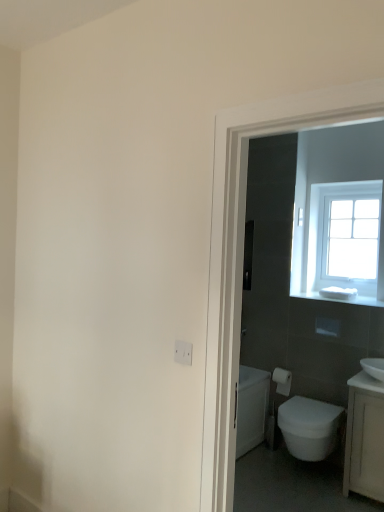
Question: Is white matte toilet paper at right oriented towards white plastic electric outlet at lower center?

Choices:
 (A) no
 (B) yes

Answer: (B)

Question: From a real-world perspective, is white matte toilet paper at right over white plastic electric outlet at lower center?

Choices:
 (A) no
 (B) yes

Answer: (A)

Question: Is white matte toilet paper at right wider than white plastic electric outlet at lower center?

Choices:
 (A) yes
 (B) no

Answer: (A)

Question: Does white matte toilet paper at right come behind white plastic electric outlet at lower center?

Choices:
 (A) no
 (B) yes

Answer: (B)

Question: Is white matte toilet paper at right far from white plastic electric outlet at lower center?

Choices:
 (A) yes
 (B) no

Answer: (A)

Question: Considering the positions of white matte toilet paper at right and white glossy bidet at lower right in the image, is white matte toilet paper at right bigger or smaller than white glossy bidet at lower right?

Choices:
 (A) small
 (B) big

Answer: (A)

Question: Considering their positions, is white matte toilet paper at right located in front of or behind white glossy bidet at lower right?

Choices:
 (A) front
 (B) behind

Answer: (B)

Question: Visually, is white matte toilet paper at right positioned to the left or to the right of white glossy bidet at lower right?

Choices:
 (A) left
 (B) right

Answer: (A)

Question: Is white matte toilet paper at right spatially inside white glossy bidet at lower right, or outside of it?

Choices:
 (A) inside
 (B) outside

Answer: (B)

Question: Considering the relative positions of white matte toilet paper at right and white plastic electric outlet at lower center in the image provided, is white matte toilet paper at right to the left or to the right of white plastic electric outlet at lower center?

Choices:
 (A) right
 (B) left

Answer: (A)

Question: Relative to white plastic electric outlet at lower center, is white matte toilet paper at right in front or behind?

Choices:
 (A) front
 (B) behind

Answer: (B)

Question: From a real-world perspective, is white matte toilet paper at right above or below white plastic electric outlet at lower center?

Choices:
 (A) above
 (B) below

Answer: (B)

Question: Considering the positions of point (273, 371) and point (178, 360), is point (273, 371) closer or farther from the camera than point (178, 360)?

Choices:
 (A) farther
 (B) closer

Answer: (A)

Question: From a real-world perspective, relative to white glossy bidet at lower right, is white plastic electric outlet at lower center vertically above or below?

Choices:
 (A) below
 (B) above

Answer: (B)

Question: Would you say white plastic electric outlet at lower center is to the left or to the right of white glossy bidet at lower right in the picture?

Choices:
 (A) right
 (B) left

Answer: (B)